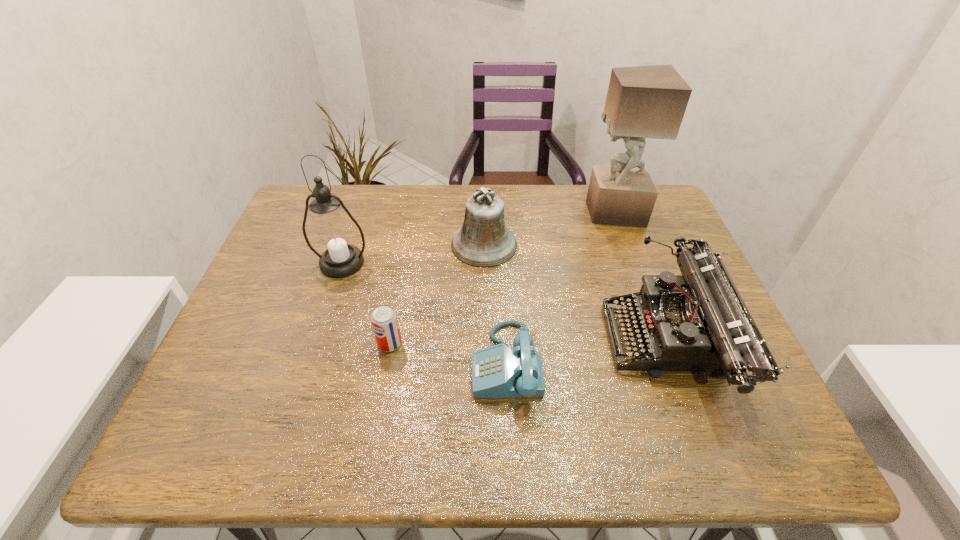
Identify the location of free space between the bell and the sculpture. (549, 228).

You are a GUI agent. You are given a task and a screenshot of the screen. Output one action in this format:
    pyautogui.click(x=<x>, y=<y>)
    Task: Click on the vacant space that's between the sculpture and the fifth tallest object
    
    Given the screenshot: What is the action you would take?
    pyautogui.click(x=501, y=278)

Where is `vacant space in between the bell and the fifth tallest object`? Image resolution: width=960 pixels, height=540 pixels. vacant space in between the bell and the fifth tallest object is located at coordinates (437, 294).

Locate an element on the screen. The height and width of the screenshot is (540, 960). object that is the fourth closest to the fifth shortest object is located at coordinates (697, 321).

Image resolution: width=960 pixels, height=540 pixels. Identify the location of object that is the second closest to the bell. (697, 321).

Find the location of a particular element. This screenshot has width=960, height=540. free space that satisfies the following two spatial constraints: 1. on the front-facing side of the sculpture; 2. on the front side of the fifth tallest object is located at coordinates (660, 343).

Locate an element on the screen. The image size is (960, 540). vacant position in the image that satisfies the following two spatial constraints: 1. on the front-facing side of the sculpture; 2. on the front side of the fifth tallest object is located at coordinates (660, 343).